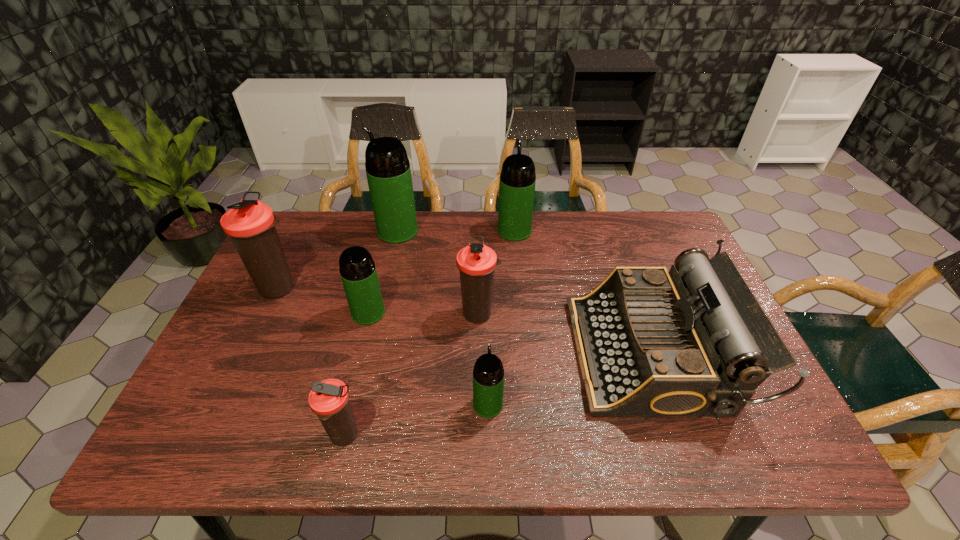
Locate which green thermos bottle is the second closest to the leftmost thermos bottle. Please provide its 2D coordinates. Your answer should be formatted as a tuple, i.e. [(x, y)], where the tuple contains the x and y coordinates of a point satisfying the conditions above.

[(388, 171)]

Locate which green thermos bottle is the third closest to the seventh object from left to right. Please provide its 2D coordinates. Your answer should be formatted as a tuple, i.e. [(x, y)], where the tuple contains the x and y coordinates of a point satisfying the conditions above.

[(488, 374)]

Locate an element on the screen. This screenshot has width=960, height=540. brown thermos bottle that is the nearest to the smallest brown thermos bottle is located at coordinates (476, 262).

Image resolution: width=960 pixels, height=540 pixels. Find the location of `brown thermos bottle that stands as the third closest to the rightmost object`. brown thermos bottle that stands as the third closest to the rightmost object is located at coordinates (250, 224).

I want to click on free space that satisfies the following two spatial constraints: 1. from the spout of the biggest green thermos bottle; 2. on the right side of the rightmost brown thermos bottle, so click(379, 313).

Image resolution: width=960 pixels, height=540 pixels. Identify the location of vacant position in the image that satisfies the following two spatial constraints: 1. from the spout of the third green thermos bottle from left to right; 2. from the spout of the biggest green thermos bottle. (486, 231).

Where is `vacant space that satisfies the following two spatial constraints: 1. from the spout of the smallest brown thermos bottle; 2. on the left side of the second smallest green thermos bottle`? This screenshot has width=960, height=540. vacant space that satisfies the following two spatial constraints: 1. from the spout of the smallest brown thermos bottle; 2. on the left side of the second smallest green thermos bottle is located at coordinates (338, 436).